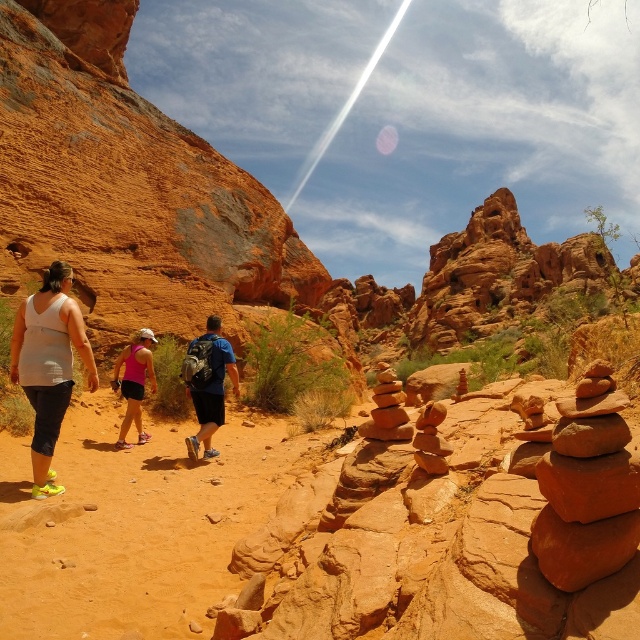
Question: Which object appears closest to the camera in this image?

Choices:
 (A) smooth sandstone rock formation at center
 (B) white matte tank top at left
 (C) blue fabric backpack at center
 (D) sandy dirt trail at center

Answer: (A)

Question: In this image, where is smooth sandstone rock formation at center located relative to sandy dirt trail at center?

Choices:
 (A) left
 (B) right

Answer: (B)

Question: Observing the image, what is the correct spatial positioning of sandy dirt trail at center in reference to white matte tank top at left?

Choices:
 (A) left
 (B) right

Answer: (B)

Question: Which object is the farthest from the smooth sandstone rock formation at center?

Choices:
 (A) white matte tank top at left
 (B) pink fabric shorts at lower left
 (C) blue fabric backpack at center

Answer: (B)

Question: Is white matte tank top at left above pink fabric shorts at lower left?

Choices:
 (A) no
 (B) yes

Answer: (B)

Question: Which point is farther to the camera?

Choices:
 (A) (234, 360)
 (B) (13, 637)

Answer: (A)